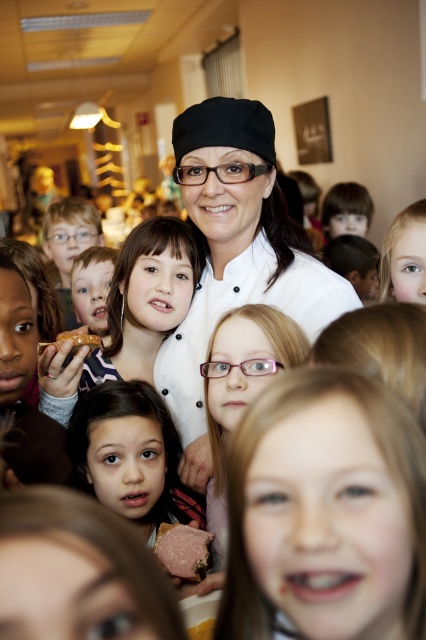
You are a photographer trying to capture both the smooth blonde hair at center and the matte brown hair at center in a single frame. Given their sizes, which hair would appear smaller in the photo?

The smooth blonde hair at center would appear smaller in the photo because it has a smaller size compared to the matte brown hair at center.

You are standing in the school cafeteria and see the image. You need to locate the matte white shirt at center. Where would you look?

The matte white shirt at center is located at the coordinates point (92, 285).

Looking at this image, you are standing at the origin point in the image and want to move towards the point labeled as point (160, 444). However, there is an obstacle at point (412, 624). Will you encounter this obstacle before reaching your destination?

Yes, you will encounter the obstacle at point (412, 624) before reaching the destination at point (160, 444) because point (412, 624) is in front of point (160, 444) from the origin.